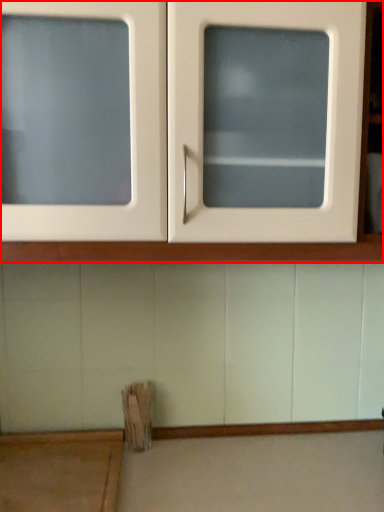
Question: From the image's perspective, what is the correct spatial relationship of cabinetry (annotated by the red box) in relation to table?

Choices:
 (A) below
 (B) above

Answer: (B)